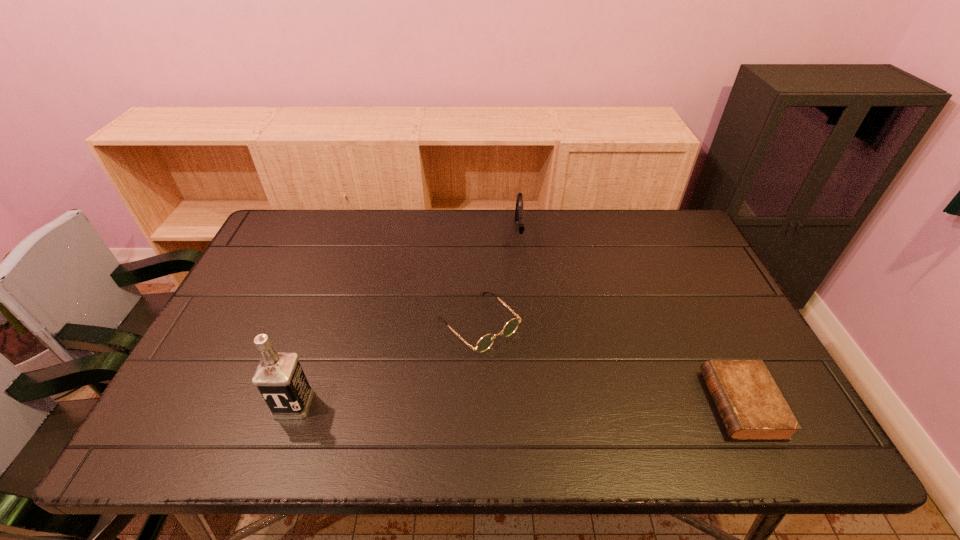
You are a GUI agent. You are given a task and a screenshot of the screen. Output one action in this format:
    pyautogui.click(x=<x>, y=<y>)
    Task: Click on the free spot that satisfies the following two spatial constraints: 1. on the front side of the spectacles; 2. on the spine side of the shortest object
    
    Given the screenshot: What is the action you would take?
    pyautogui.click(x=479, y=404)

This screenshot has height=540, width=960. What are the coordinates of `vacant space that satisfies the following two spatial constraints: 1. on the front side of the rightmost object; 2. on the spine side of the third nearest object` in the screenshot? It's located at (479, 404).